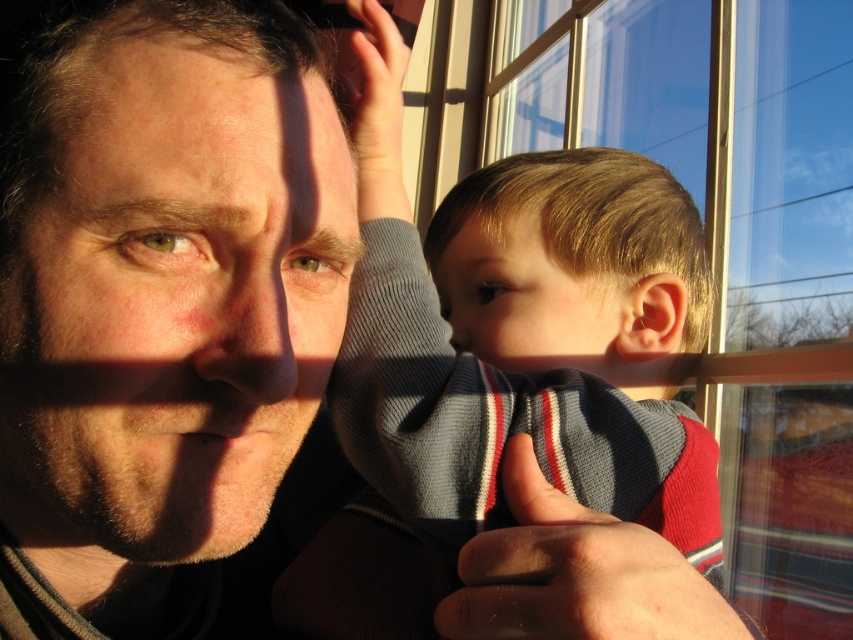
Is smooth skin face at center to the right of clear glass window at upper center from the viewer's perspective?

Incorrect, smooth skin face at center is not on the right side of clear glass window at upper center.

Can you confirm if smooth skin face at center is shorter than clear glass window at upper center?

Correct, smooth skin face at center is not as tall as clear glass window at upper center.

Identify the location of smooth skin face at center. This screenshot has width=853, height=640. (160, 305).

Between clear glass window at upper center and striped knit sweater at center, which one appears on the right side from the viewer's perspective?

From the viewer's perspective, clear glass window at upper center appears more on the right side.

Does clear glass window at upper center have a greater width compared to striped knit sweater at center?

Yes.

Between point (722, 445) and point (648, 230), which one is positioned behind?

Positioned behind is point (722, 445).

What are the coordinates of `clear glass window at upper center` in the screenshot? It's located at (730, 243).

Between smooth skin face at center and striped knit sweater at center, which one appears on the right side from the viewer's perspective?

Positioned to the right is striped knit sweater at center.

Between smooth skin face at center and striped knit sweater at center, which one has more height?

striped knit sweater at center

Which is behind, point (132, 362) or point (627, 160)?

Point (627, 160)

At what (x,y) coordinates should I click in order to perform the action: click on smooth skin face at center. Please return your answer as a coordinate pair (x, y). Image resolution: width=853 pixels, height=640 pixels. Looking at the image, I should click on (160, 305).